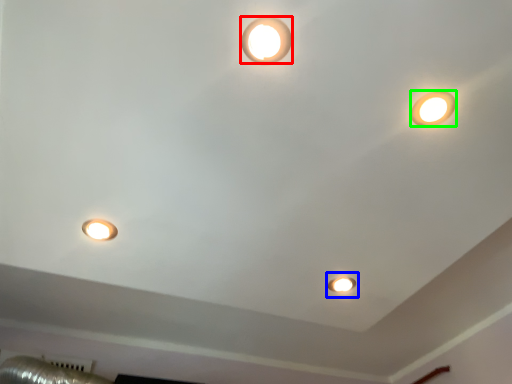
Question: Considering the real-world distances, which object is closest to lamp (highlighted by a red box)? stage light (highlighted by a blue box) or lamp (highlighted by a green box).

Choices:
 (A) stage light
 (B) lamp

Answer: (B)